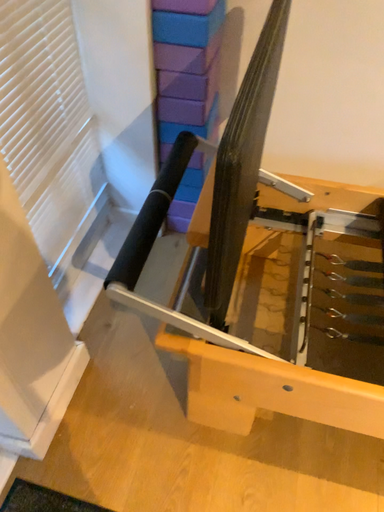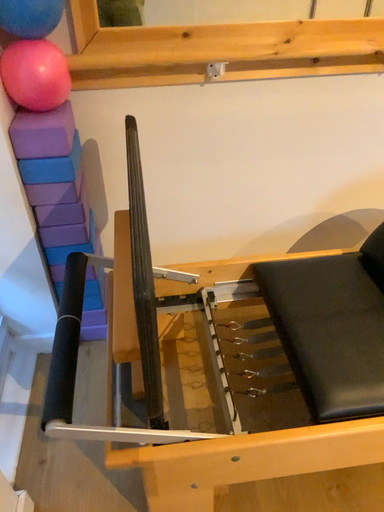
Question: How did the camera likely rotate when shooting the video?

Choices:
 (A) rotated downward
 (B) rotated upward

Answer: (B)